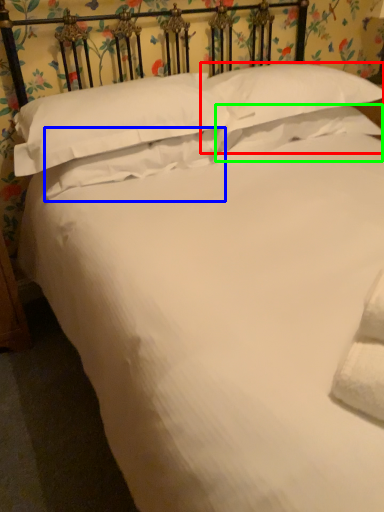
Question: Estimate the real-world distances between objects in this image. Which object is farther from pillow (highlighted by a red box), pillow (highlighted by a blue box) or pillow (highlighted by a green box)?

Choices:
 (A) pillow
 (B) pillow

Answer: (A)